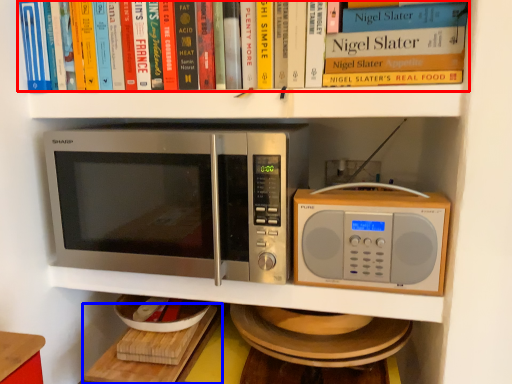
Question: Among these objects, which one is nearest to the camera, book (highlighted by a red box) or table (highlighted by a blue box)?

Choices:
 (A) book
 (B) table

Answer: (A)